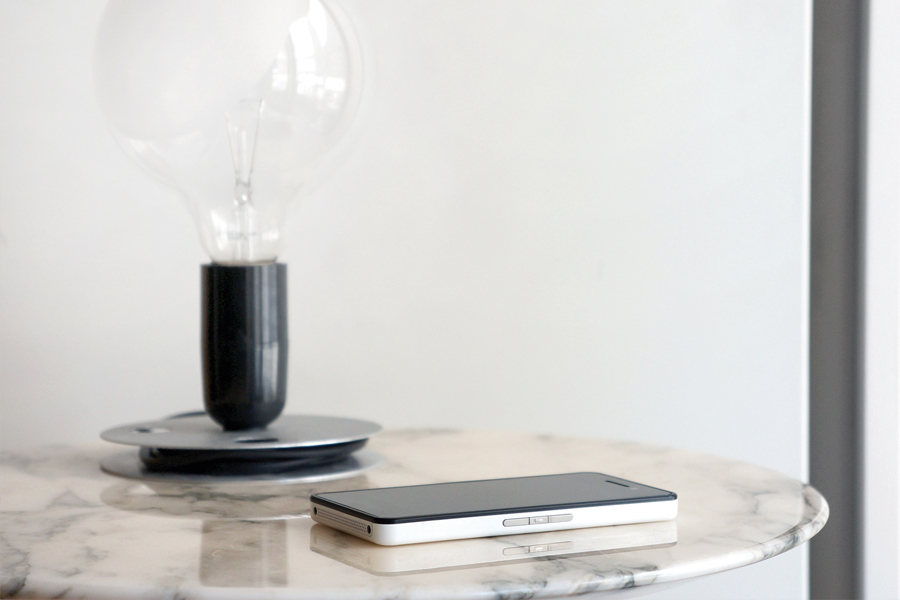
Where is `stand`? The image size is (900, 600). stand is located at coordinates (158, 424).